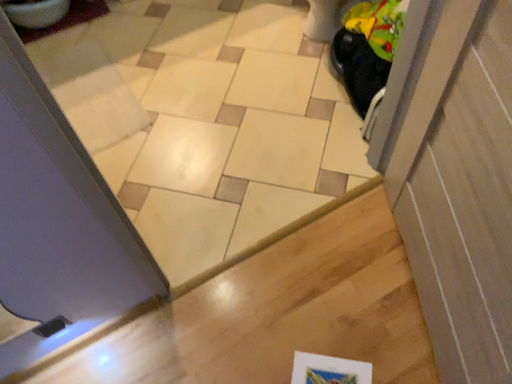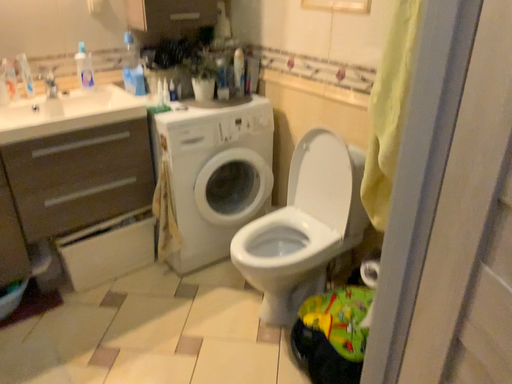
Question: Which way did the camera rotate in the video?

Choices:
 (A) rotated left
 (B) rotated right

Answer: (B)